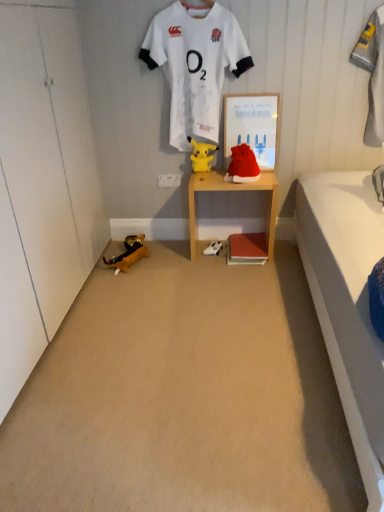
Question: Could you tell me if wooden shelf at center is turned towards white jersey at upper center?

Choices:
 (A) no
 (B) yes

Answer: (A)

Question: Can you confirm if wooden shelf at center is thinner than white jersey at upper center?

Choices:
 (A) yes
 (B) no

Answer: (B)

Question: Can you see wooden shelf at center touching white jersey at upper center?

Choices:
 (A) no
 (B) yes

Answer: (A)

Question: Is wooden shelf at center at the right side of white jersey at upper center?

Choices:
 (A) yes
 (B) no

Answer: (A)

Question: Does wooden shelf at center have a smaller size compared to white jersey at upper center?

Choices:
 (A) no
 (B) yes

Answer: (A)

Question: Is gray fabric towel at upper right bigger or smaller than yellow plush toy at lower left, the 3th toy positioned from the right?

Choices:
 (A) big
 (B) small

Answer: (A)

Question: Considering the positions of point (357, 52) and point (120, 263), is point (357, 52) closer or farther from the camera than point (120, 263)?

Choices:
 (A) closer
 (B) farther

Answer: (A)

Question: Choose the correct answer: Is gray fabric towel at upper right inside yellow plush toy at lower left, the 3th toy positioned from the right, or outside it?

Choices:
 (A) inside
 (B) outside

Answer: (B)

Question: Is gray fabric towel at upper right taller or shorter than yellow plush toy at lower left, the first toy positioned from the left?

Choices:
 (A) tall
 (B) short

Answer: (A)

Question: Is point (377, 49) positioned closer to the camera than point (172, 117)?

Choices:
 (A) closer
 (B) farther

Answer: (A)

Question: Considering the positions of gray fabric towel at upper right and white jersey at upper center in the image, is gray fabric towel at upper right taller or shorter than white jersey at upper center?

Choices:
 (A) tall
 (B) short

Answer: (B)

Question: Looking at their shapes, would you say gray fabric towel at upper right is wider or thinner than white jersey at upper center?

Choices:
 (A) wide
 (B) thin

Answer: (B)

Question: Relative to white jersey at upper center, is gray fabric towel at upper right in front or behind?

Choices:
 (A) front
 (B) behind

Answer: (A)

Question: Considering their positions, is yellow plush toy at center, which appears as the 1th toy when viewed from the top, located in front of or behind yellow plush toy at lower left, the first toy positioned from the left?

Choices:
 (A) front
 (B) behind

Answer: (A)

Question: Which is correct: yellow plush toy at center, the 3th toy from the bottom, is inside yellow plush toy at lower left, which is the 3th toy from top to bottom, or outside of it?

Choices:
 (A) outside
 (B) inside

Answer: (A)